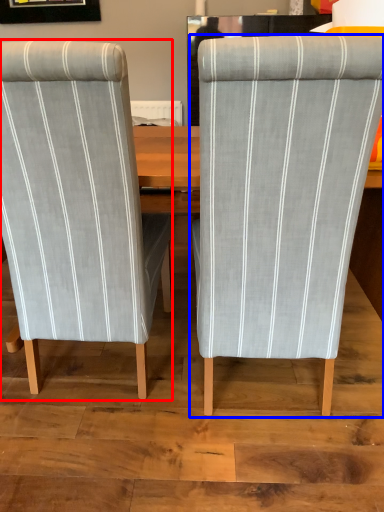
Question: Which of the following is the closest to the observer, chair (highlighted by a red box) or chair (highlighted by a blue box)?

Choices:
 (A) chair
 (B) chair

Answer: (B)